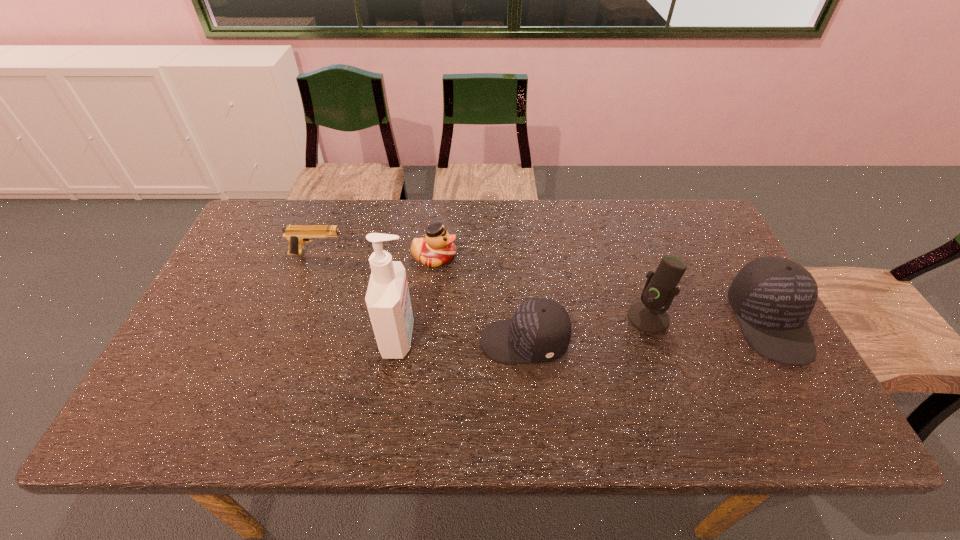
At what (x,y) coordinates should I click in order to perform the action: click on vacant space situated 0.100m at the front of the fourth object from left to right where the brim is located. Please return your answer as a coordinate pair (x, y). The image size is (960, 540). Looking at the image, I should click on (440, 342).

You are a GUI agent. You are given a task and a screenshot of the screen. Output one action in this format:
    pyautogui.click(x=<x>, y=<y>)
    Task: Click on the vacant space located 0.240m at the front of the fourth object from left to right where the brim is located
    
    Given the screenshot: What is the action you would take?
    384,342

This screenshot has width=960, height=540. I want to click on free space located at the front of the fourth object from left to right where the brim is located, so click(392, 342).

Identify the location of free space located on the face of the duck. This screenshot has width=960, height=540. (535, 257).

The height and width of the screenshot is (540, 960). In order to click on vacant region located 0.100m on the front label of the tallest object in this screenshot , I will do `click(456, 338)`.

Locate an element on the screen. vacant space situated 0.160m at the barrel of the shortest object is located at coordinates (398, 254).

The image size is (960, 540). I want to click on vacant space located 0.110m on the back of the fifth object from left to right, so click(634, 274).

Locate an element on the screen. object at the far edge is located at coordinates (437, 248).

Find the location of a particular element. The height and width of the screenshot is (540, 960). object located at the right edge is located at coordinates (772, 297).

Where is `object located in the near right corner section of the desktop`? object located in the near right corner section of the desktop is located at coordinates (772, 297).